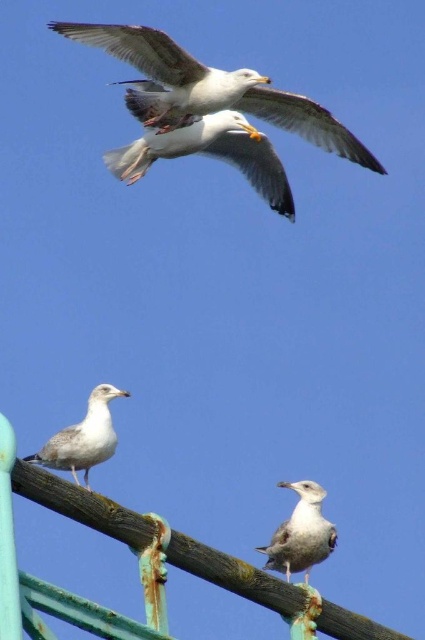
In the image of seagulls against a clear blue sky, there are two seagulls at the center. The white feathered seagull at center and the light gray feathered seagull at center. Which one is positioned to the right?

The white feathered seagull at center is positioned to the right of the light gray feathered seagull at center.

You are a photographer trying to capture the white feathered seagull at upper center in the center of your camera frame. Given the seagull is located at coordinates 0.242 on the x axis and 0.496 on the y axis, will you need to move your camera to the left or right to center it horizontally?

The white feathered seagull at upper center is located at x coordinate 0.242. Since the center of the frame is at x coordinate 0.5, the photographer needs to move the camera to the right to center it horizontally.

You are a birdwatcher trying to identify seagulls in the sky. You see the white feathered seagull at upper center and the white feathered seagull at center. Which one appears wider in size?

The white feathered seagull at upper center appears wider in size than the white feathered seagull at center because its width is larger.